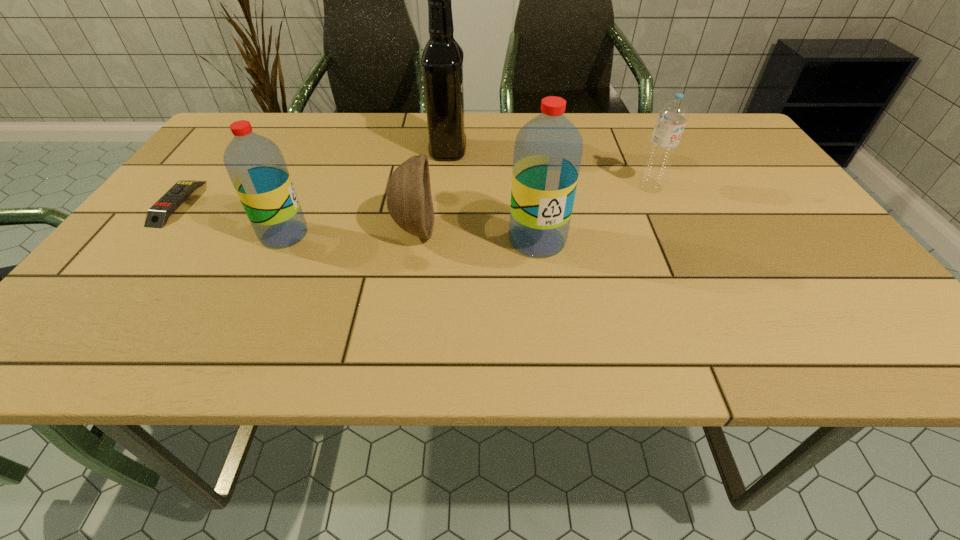
Where is `the leftmost water bottle`? The image size is (960, 540). the leftmost water bottle is located at coordinates (255, 164).

Image resolution: width=960 pixels, height=540 pixels. In order to click on the second water bottle from right to left in this screenshot , I will do `click(548, 149)`.

This screenshot has height=540, width=960. Find the location of `the fifth object from left to right`. the fifth object from left to right is located at coordinates (548, 149).

The height and width of the screenshot is (540, 960). What are the coordinates of `the rightmost water bottle` in the screenshot? It's located at (672, 116).

At what (x,y) coordinates should I click in order to perform the action: click on the rightmost object. Please return your answer as a coordinate pair (x, y). Image resolution: width=960 pixels, height=540 pixels. Looking at the image, I should click on (672, 116).

Locate an element on the screen. the shortest object is located at coordinates click(x=157, y=216).

Where is `remote control`? remote control is located at coordinates (157, 216).

What are the coordinates of `the tallest object` in the screenshot? It's located at (442, 60).

Identify the location of liquor. (442, 60).

Find the location of a particular element. bowl is located at coordinates (409, 201).